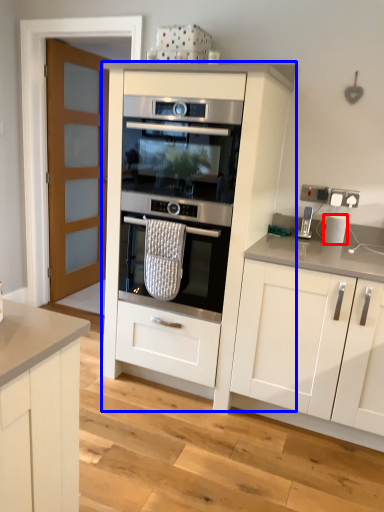
Question: Which of the following is the closest to the observer, kitchen appliance (highlighted by a red box) or cabinetry (highlighted by a blue box)?

Choices:
 (A) kitchen appliance
 (B) cabinetry

Answer: (B)